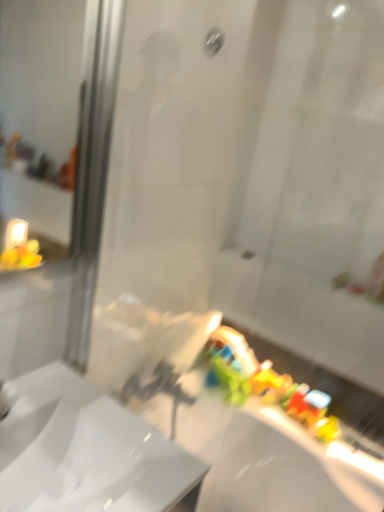
Question: Is matte silver shower at upper center wider than white glossy bath at lower right?

Choices:
 (A) no
 (B) yes

Answer: (A)

Question: Is white glossy bath at lower right completely or partially inside matte silver shower at upper center?

Choices:
 (A) no
 (B) yes

Answer: (A)

Question: Is the depth of matte silver shower at upper center greater than that of white glossy bath at lower right?

Choices:
 (A) no
 (B) yes

Answer: (B)

Question: Considering the relative positions of matte silver shower at upper center and white glossy bath at lower right in the image provided, is matte silver shower at upper center in front of white glossy bath at lower right?

Choices:
 (A) no
 (B) yes

Answer: (A)

Question: From a real-world perspective, is matte silver shower at upper center beneath white glossy bath at lower right?

Choices:
 (A) yes
 (B) no

Answer: (B)

Question: Can you confirm if matte silver shower at upper center is taller than white glossy bath at lower right?

Choices:
 (A) no
 (B) yes

Answer: (A)

Question: Considering the relative positions of white glossy sink at center and matte silver shower at upper center in the image provided, is white glossy sink at center in front of matte silver shower at upper center?

Choices:
 (A) yes
 (B) no

Answer: (A)

Question: Considering the relative sizes of white glossy sink at center and matte silver shower at upper center in the image provided, is white glossy sink at center shorter than matte silver shower at upper center?

Choices:
 (A) yes
 (B) no

Answer: (B)

Question: Is white glossy sink at center wider than matte silver shower at upper center?

Choices:
 (A) no
 (B) yes

Answer: (B)

Question: From the image's perspective, does white glossy sink at center appear higher than matte silver shower at upper center?

Choices:
 (A) yes
 (B) no

Answer: (B)

Question: Is white glossy sink at center turned away from matte silver shower at upper center?

Choices:
 (A) no
 (B) yes

Answer: (A)

Question: From the image's perspective, is white glossy sink at center beneath matte silver shower at upper center?

Choices:
 (A) yes
 (B) no

Answer: (A)

Question: Does matte silver shower at upper center have a greater height compared to white glossy sink at center?

Choices:
 (A) no
 (B) yes

Answer: (A)